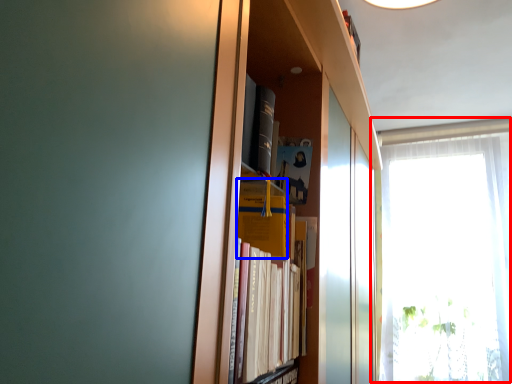
Question: Which point is further to the camera, window (highlighted by a red box) or paperback book (highlighted by a blue box)?

Choices:
 (A) window
 (B) paperback book

Answer: (A)